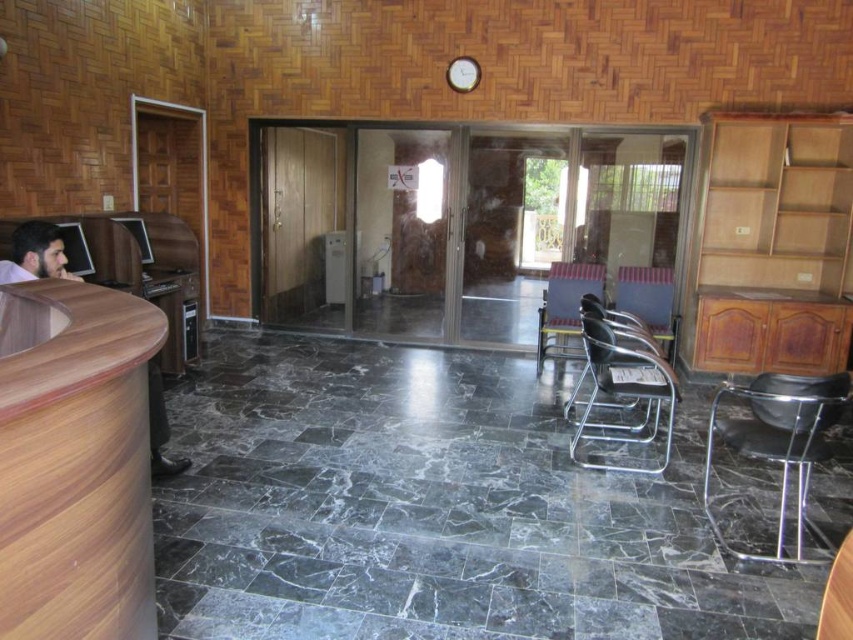
You are a visitor standing at the entrance of the office and see both the wooden reception desk at left and the brown wood desk at left. Which desk should you approach first to ask for assistance?

You should approach the wooden reception desk at left first because it is closer to you than the brown wood desk at left, which is further away.

You are a visitor entering the office and want to approach the wooden reception desk at left and the metallic black chair at lower right. Which object should you walk towards first if you want to reach the one closer to the entrance?

The wooden reception desk at left is positioned on the left side of the metallic black chair at lower right, so it is closer to the entrance. Therefore, you should walk towards the wooden reception desk at left first.

You are a delivery person trying to place a large package on the floor near the metallic black chair at lower right and the brown wood desk at left. Which object should you place the package closer to if you want it to be less obstructive to foot traffic?

You should place the package closer to the brown wood desk at left because the metallic black chair at lower right is larger in size, so placing the package near the smaller desk would be less obstructive to foot traffic.